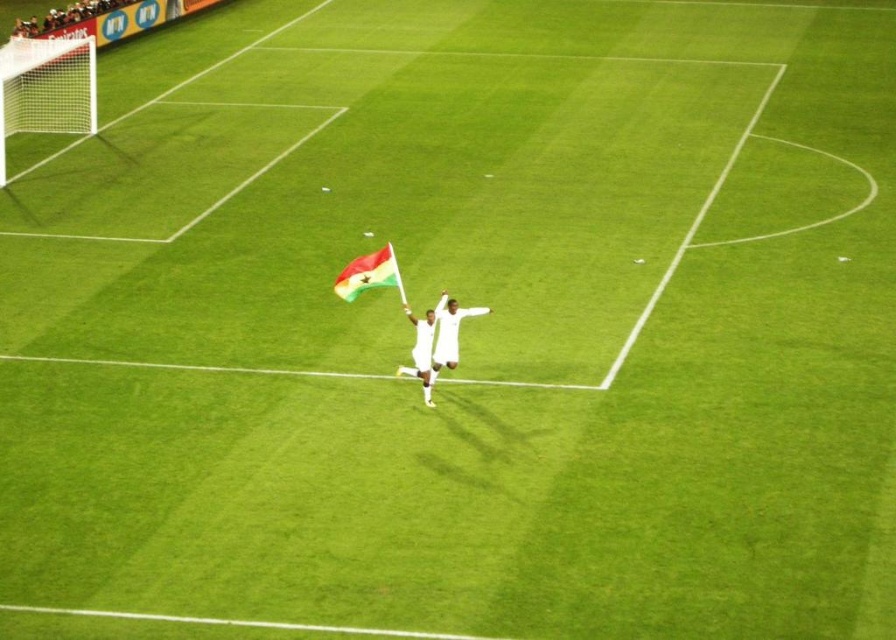
Which is below, green fabric flag at center or white fabric flag at center?

Positioned lower is white fabric flag at center.

In the scene shown: Which of these two, green fabric flag at center or white fabric flag at center, stands taller?

With more height is white fabric flag at center.

Find the location of a particular element. The height and width of the screenshot is (640, 896). green fabric flag at center is located at coordinates (369, 275).

Does green fabric flag at center have a greater width compared to white fabric at center?

Yes.

Which is behind, point (351, 273) or point (438, 300)?

Point (438, 300)

Locate an element on the screen. The height and width of the screenshot is (640, 896). green fabric flag at center is located at coordinates (369, 275).

Which is above, white plastic goal at upper left or green fabric flag at center?

white plastic goal at upper left

Does point (69, 122) lie in front of point (333, 285)?

No.

Which is behind, point (22, 64) or point (373, 252)?

Positioned behind is point (22, 64).

Image resolution: width=896 pixels, height=640 pixels. What are the coordinates of `white plastic goal at upper left` in the screenshot? It's located at (46, 88).